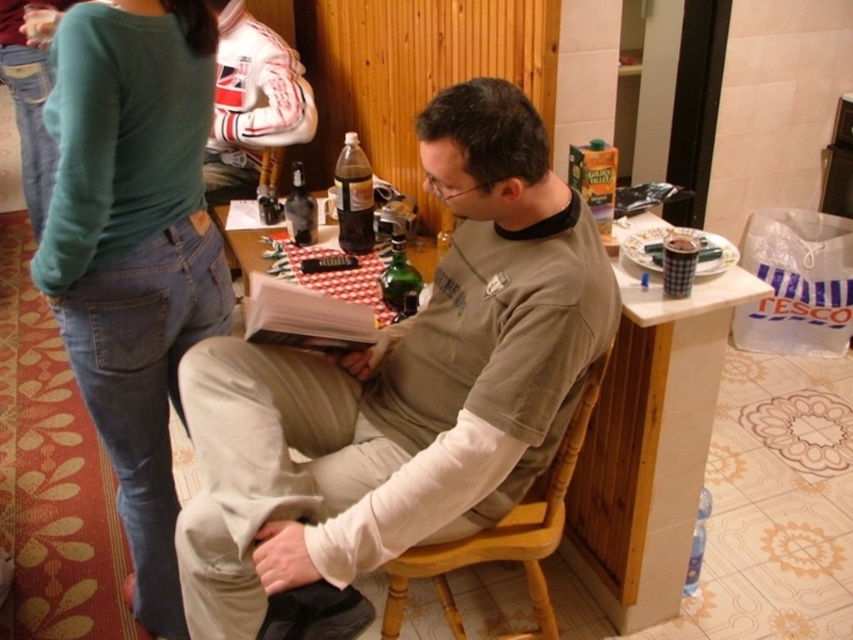
Looking at this image, can you confirm if green cotton sweater at upper left is positioned to the left of wooden chair at center?

Indeed, green cotton sweater at upper left is positioned on the left side of wooden chair at center.

Does green cotton sweater at upper left come in front of wooden chair at center?

Yes, green cotton sweater at upper left is in front of wooden chair at center.

Between point (120, 173) and point (517, 531), which one is positioned behind?

The point (517, 531) is behind.

Locate an element on the screen. The width and height of the screenshot is (853, 640). green cotton sweater at upper left is located at coordinates (134, 248).

Which is more to the right, wooden chair at center or dark brown glass bottle at center?

wooden chair at center

Is point (538, 621) in front of point (345, 166)?

Yes, point (538, 621) is closer to viewer.

The height and width of the screenshot is (640, 853). I want to click on wooden chair at center, so click(503, 536).

Who is more distant from viewer, (358, 408) or (577, 426)?

The point (358, 408) is more distant.

Consider the image. Is matte gray shirt at center taller than wooden chair at center?

Yes, matte gray shirt at center is taller than wooden chair at center.

Which is behind, point (366, 516) or point (581, 436)?

The point (581, 436) is more distant.

Find the location of a particular element. matte gray shirt at center is located at coordinates (402, 385).